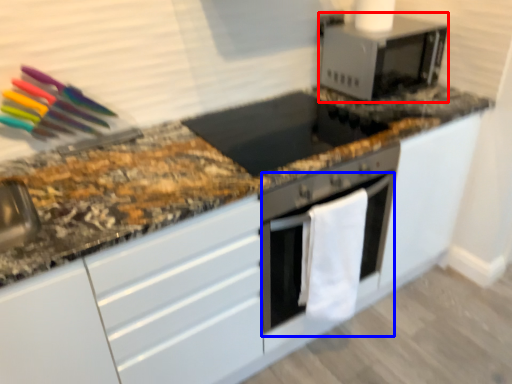
Question: Which object is further to the camera taking this photo, microwave oven (highlighted by a red box) or oven (highlighted by a blue box)?

Choices:
 (A) microwave oven
 (B) oven

Answer: (A)